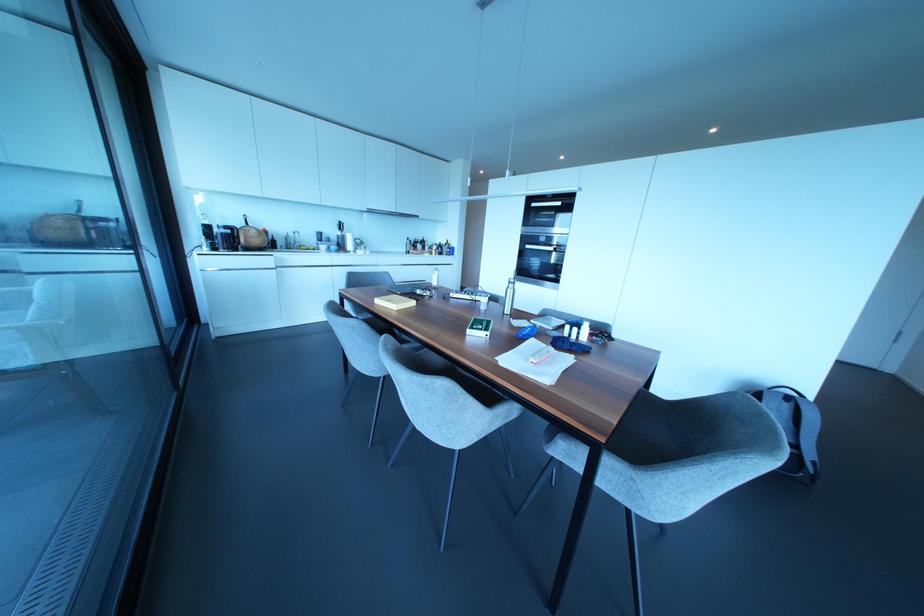
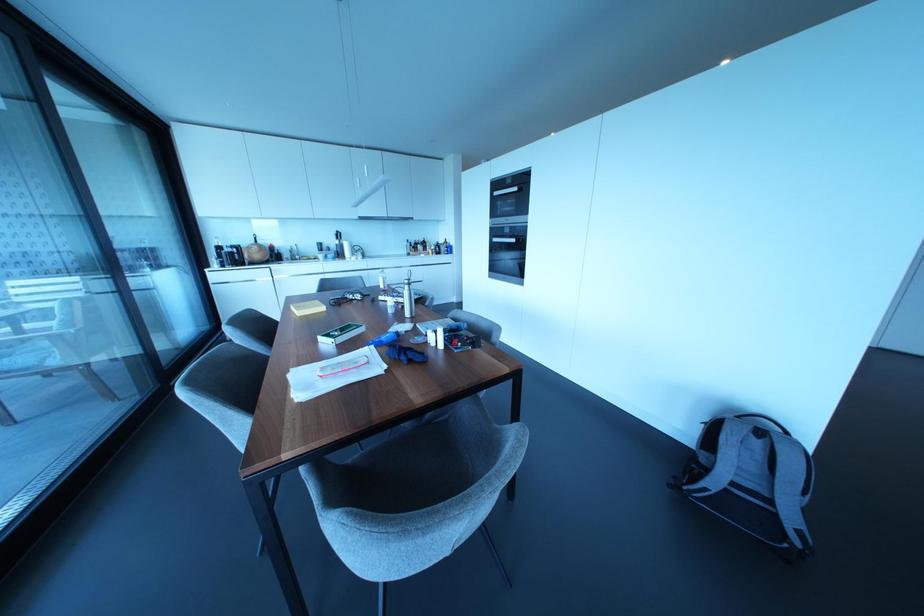
Where in the second image is the point corresponding to point (801, 395) from the first image?

(785, 431)